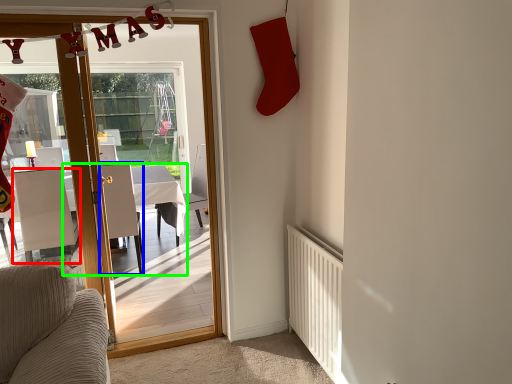
Question: Estimate the real-world distances between objects in this image. Which object is farther from chair (highlighted by a red box), chair (highlighted by a blue box) or table (highlighted by a green box)?

Choices:
 (A) chair
 (B) table

Answer: (B)